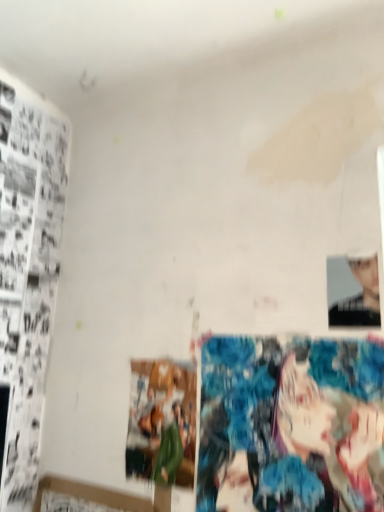
Question: Considering the relative positions of smooth black portrait at upper right and matte paper print at center in the image provided, is smooth black portrait at upper right to the right of matte paper print at center from the viewer's perspective?

Choices:
 (A) yes
 (B) no

Answer: (A)

Question: Are smooth black portrait at upper right and matte paper print at center far apart?

Choices:
 (A) no
 (B) yes

Answer: (A)

Question: Can you confirm if smooth black portrait at upper right is shorter than matte paper print at center?

Choices:
 (A) no
 (B) yes

Answer: (B)

Question: Considering the relative positions of smooth black portrait at upper right and matte paper print at center in the image provided, is smooth black portrait at upper right to the left of matte paper print at center from the viewer's perspective?

Choices:
 (A) yes
 (B) no

Answer: (B)

Question: From a real-world perspective, is smooth black portrait at upper right below matte paper print at center?

Choices:
 (A) no
 (B) yes

Answer: (A)

Question: From their relative heights in the image, would you say smooth black portrait at upper right is taller or shorter than matte paper print at center?

Choices:
 (A) tall
 (B) short

Answer: (B)

Question: Looking at their shapes, would you say smooth black portrait at upper right is wider or thinner than matte paper print at center?

Choices:
 (A) thin
 (B) wide

Answer: (A)

Question: Relative to matte paper print at center, is smooth black portrait at upper right in front or behind?

Choices:
 (A) behind
 (B) front

Answer: (B)

Question: Is smooth black portrait at upper right inside the boundaries of matte paper print at center, or outside?

Choices:
 (A) inside
 (B) outside

Answer: (B)

Question: Considering the positions of colorful fabric art at lower right and matte paper print at center in the image, is colorful fabric art at lower right bigger or smaller than matte paper print at center?

Choices:
 (A) big
 (B) small

Answer: (A)

Question: Is colorful fabric art at lower right in front of or behind matte paper print at center in the image?

Choices:
 (A) behind
 (B) front

Answer: (B)

Question: From the image's perspective, is colorful fabric art at lower right located above or below matte paper print at center?

Choices:
 (A) above
 (B) below

Answer: (A)

Question: Which is correct: colorful fabric art at lower right is inside matte paper print at center, or outside of it?

Choices:
 (A) inside
 (B) outside

Answer: (B)

Question: Which is correct: smooth black portrait at upper right is inside colorful fabric art at lower right, or outside of it?

Choices:
 (A) outside
 (B) inside

Answer: (A)

Question: In terms of size, does smooth black portrait at upper right appear bigger or smaller than colorful fabric art at lower right?

Choices:
 (A) small
 (B) big

Answer: (A)